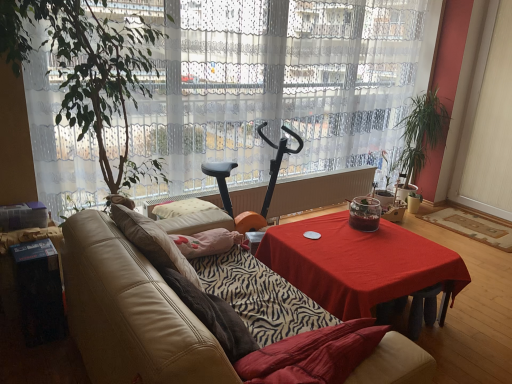
Where is `vacant space to the right of transparent glass jar at center`? vacant space to the right of transparent glass jar at center is located at coordinates (396, 232).